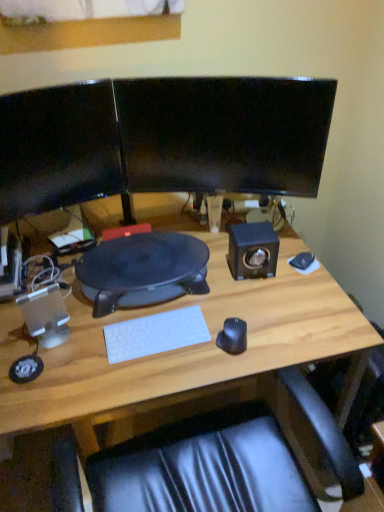
Locate an element on the screen. free space between black matte mouse at center and matte black speaker at right, the second speaker in the bottom-to-top sequence is located at coordinates (244, 301).